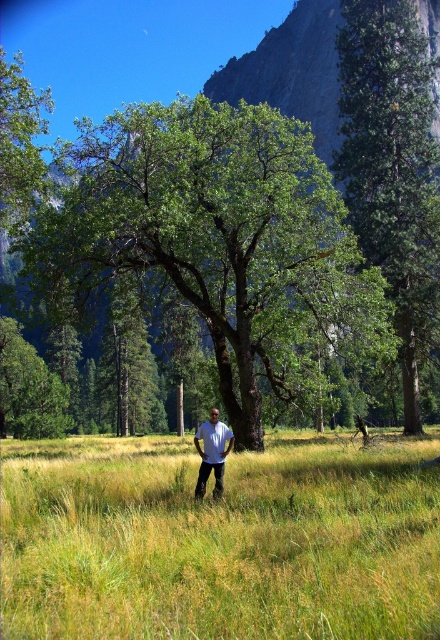
Is green leafy tree at center thinner than green rough bark tree at center?

In fact, green leafy tree at center might be wider than green rough bark tree at center.

Which is below, green leafy tree at center or green rough bark tree at center?

green rough bark tree at center is below.

Measure the distance between point (244, 365) and camera.

Point (244, 365) is 21.95 meters from camera.

You are a GUI agent. You are given a task and a screenshot of the screen. Output one action in this format:
    pyautogui.click(x=<x>, y=<y>)
    Task: Click on the green leafy tree at center
    This screenshot has width=440, height=640.
    Given the screenshot: What is the action you would take?
    pyautogui.click(x=215, y=236)

Measure the distance between point (69, 556) and camera.

They are 21.49 feet apart.

This screenshot has height=640, width=440. I want to click on green grass at center, so click(x=220, y=541).

Is point (37, 596) behind point (354, 200)?

No, it is in front of (354, 200).

Does green grass at center have a greater height compared to green rough bark tree at center?

Incorrect, green grass at center's height is not larger of green rough bark tree at center's.

Which is behind, point (234, 481) or point (422, 193)?

Point (422, 193)

In order to click on green grass at center in this screenshot , I will do `click(220, 541)`.